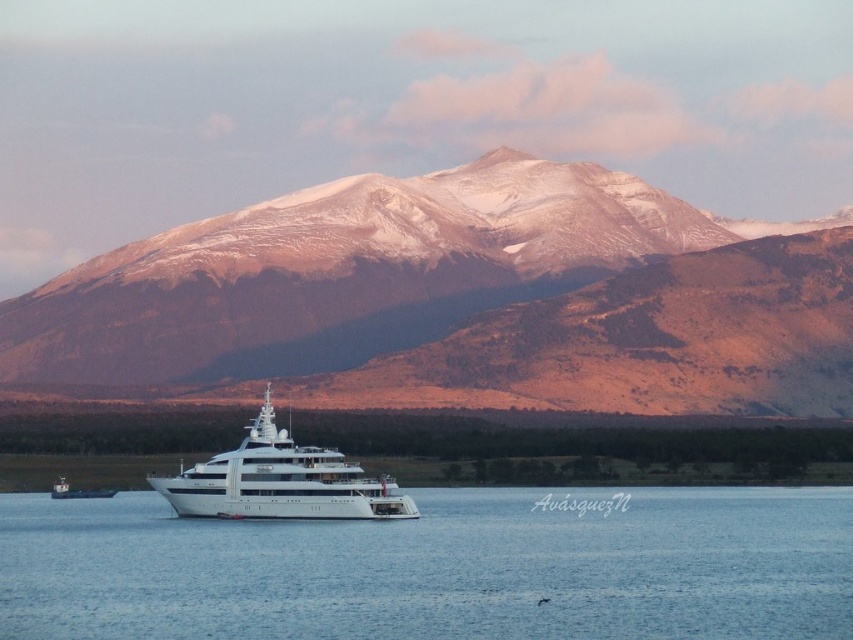
Measure the distance from clear blue water at center to white glossy cruise ship at center.

clear blue water at center and white glossy cruise ship at center are 27.57 meters apart.

Describe the element at coordinates (438, 568) in the screenshot. I see `clear blue water at center` at that location.

Where is `clear blue water at center`? The height and width of the screenshot is (640, 853). clear blue water at center is located at coordinates (438, 568).

Does point (85, 266) come closer to viewer compared to point (233, 481)?

That is False.

Locate an element on the screen. The height and width of the screenshot is (640, 853). snowy mountain range at center is located at coordinates (451, 301).

Is snowy mountain range at center positioned before clear blue water at center?

That is True.

Which is more to the right, snowy mountain range at center or clear blue water at center?

clear blue water at center is more to the right.

Is point (426, 346) positioned behind point (0, 524)?

No, (426, 346) is in front of (0, 524).

The image size is (853, 640). In order to click on snowy mountain range at center in this screenshot , I will do `click(451, 301)`.